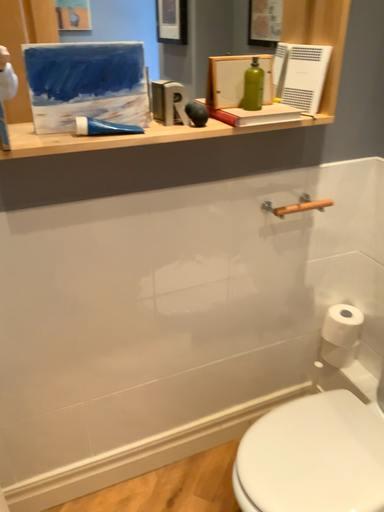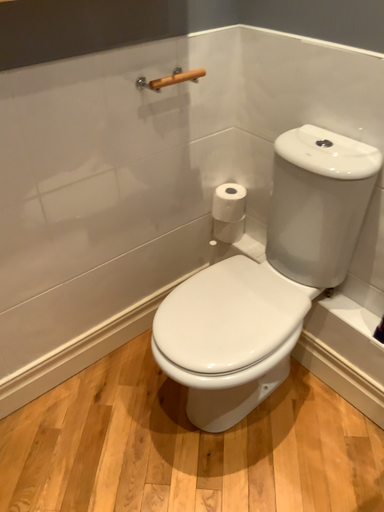
Question: Which way did the camera rotate in the video?

Choices:
 (A) rotated right
 (B) rotated left

Answer: (A)